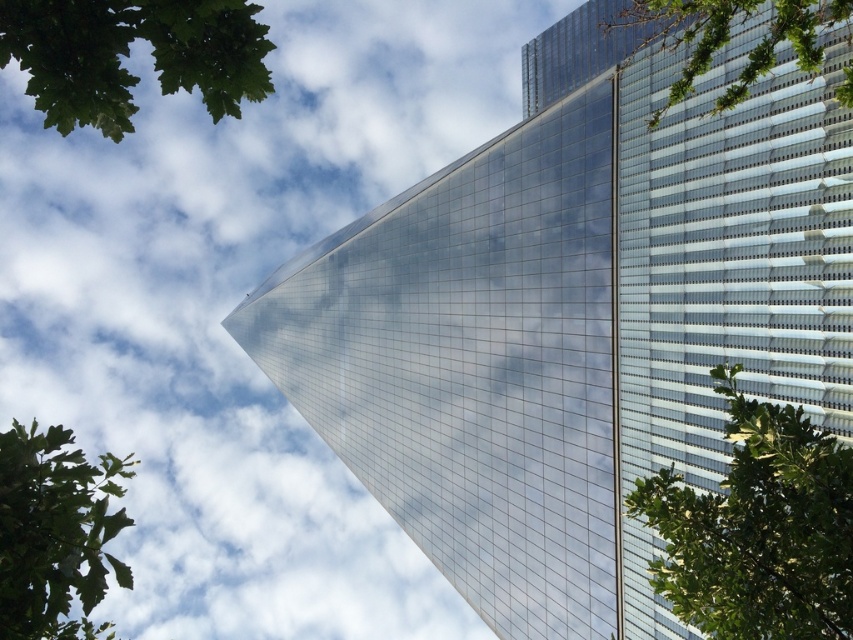
Question: Which of the following is the farthest from the observer?

Choices:
 (A) (752, 417)
 (B) (109, 99)
 (C) (90, 508)

Answer: (C)

Question: Does transparent glass tower at center have a greater width compared to green leafy tree at right?

Choices:
 (A) yes
 (B) no

Answer: (A)

Question: Estimate the real-world distances between objects in this image. Which object is farther from the green leafy tree at upper left?

Choices:
 (A) green leafy tree at upper right
 (B) green leafy tree at right
 (C) transparent glass tower at center

Answer: (C)

Question: Does green leafy tree at lower left have a larger size compared to green leafy tree at upper right?

Choices:
 (A) no
 (B) yes

Answer: (A)

Question: Which of the following is the closest to the observer?

Choices:
 (A) green leafy tree at right
 (B) green leafy tree at lower left
 (C) transparent glass tower at center

Answer: (B)

Question: Can you confirm if green leafy tree at right is positioned to the left of green leafy tree at upper left?

Choices:
 (A) yes
 (B) no

Answer: (B)